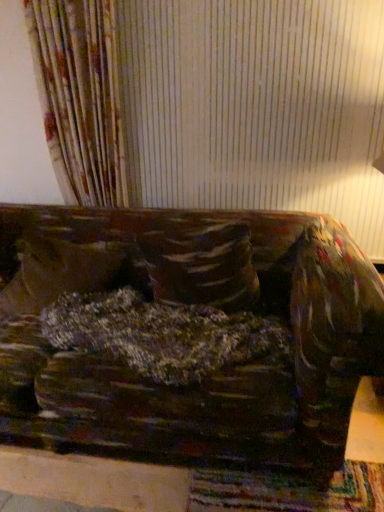
Question: Is velvety brown pillow at center, which is counted as the first pillow, starting from the right, positioned far away from velvety brown pillow at center, the 2th pillow when ordered from right to left?

Choices:
 (A) no
 (B) yes

Answer: (A)

Question: Considering the relative sizes of velvety brown pillow at center, marked as the second pillow in a left-to-right arrangement, and velvety brown pillow at center, the 2th pillow when ordered from right to left, in the image provided, is velvety brown pillow at center, marked as the second pillow in a left-to-right arrangement, wider than velvety brown pillow at center, the 2th pillow when ordered from right to left,?

Choices:
 (A) yes
 (B) no

Answer: (B)

Question: Is velvety brown pillow at center, which is counted as the first pillow, starting from the right, at the left side of velvety brown pillow at center, placed as the first pillow when sorted from left to right?

Choices:
 (A) no
 (B) yes

Answer: (A)

Question: Is velvety brown pillow at center, marked as the second pillow in a left-to-right arrangement, behind velvety brown pillow at center, placed as the first pillow when sorted from left to right?

Choices:
 (A) yes
 (B) no

Answer: (B)

Question: Is velvety brown pillow at center, marked as the second pillow in a left-to-right arrangement, oriented towards velvety brown pillow at center, the 2th pillow when ordered from right to left?

Choices:
 (A) no
 (B) yes

Answer: (A)

Question: From the image's perspective, is velvety brown pillow at center, marked as the second pillow in a left-to-right arrangement, below velvety brown pillow at center, placed as the first pillow when sorted from left to right?

Choices:
 (A) no
 (B) yes

Answer: (A)

Question: Is velvety brown pillow at center, the 2th pillow when ordered from right to left, wider than velvety brown pillow at center, which is counted as the first pillow, starting from the right?

Choices:
 (A) no
 (B) yes

Answer: (B)

Question: Would you say velvety brown pillow at center, the 2th pillow when ordered from right to left, is a long distance from velvety brown pillow at center, marked as the second pillow in a left-to-right arrangement?

Choices:
 (A) no
 (B) yes

Answer: (A)

Question: From the image's perspective, is velvety brown pillow at center, placed as the first pillow when sorted from left to right, under velvety brown pillow at center, marked as the second pillow in a left-to-right arrangement?

Choices:
 (A) yes
 (B) no

Answer: (A)

Question: From a real-world perspective, is velvety brown pillow at center, the 2th pillow when ordered from right to left, physically above velvety brown pillow at center, marked as the second pillow in a left-to-right arrangement?

Choices:
 (A) yes
 (B) no

Answer: (B)

Question: Does velvety brown pillow at center, the 2th pillow when ordered from right to left, have a greater height compared to velvety brown pillow at center, marked as the second pillow in a left-to-right arrangement?

Choices:
 (A) yes
 (B) no

Answer: (B)

Question: Is velvety brown pillow at center, which is counted as the first pillow, starting from the right, located within velvety brown pillow at center, placed as the first pillow when sorted from left to right?

Choices:
 (A) yes
 (B) no

Answer: (B)

Question: Is velvety brown pillow at center, which is counted as the first pillow, starting from the right, taller than velvet-like brown couch at center?

Choices:
 (A) yes
 (B) no

Answer: (A)